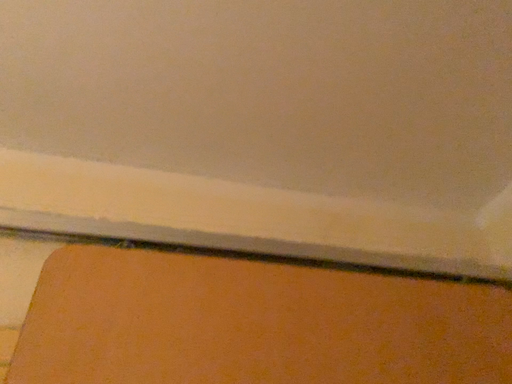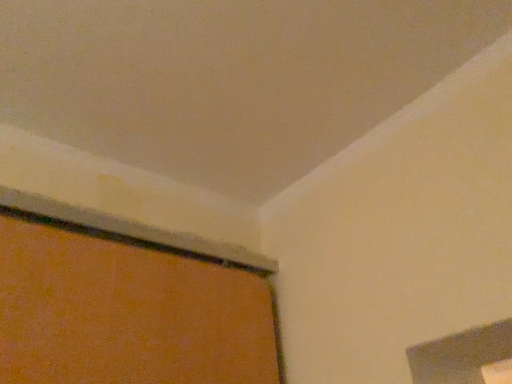
Question: Which way did the camera rotate in the video?

Choices:
 (A) rotated upward
 (B) rotated downward

Answer: (B)